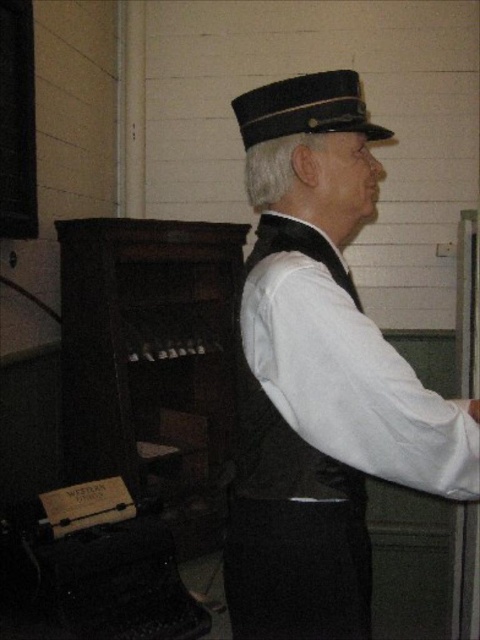
Does black matte uniform at center appear on the right side of black felt hat at upper center?

Yes, black matte uniform at center is to the right of black felt hat at upper center.

Who is shorter, black matte uniform at center or black felt hat at upper center?

black felt hat at upper center

Is point (249, 353) positioned after point (321, 97)?

That is False.

In order to click on black matte uniform at center in this screenshot , I will do `click(320, 376)`.